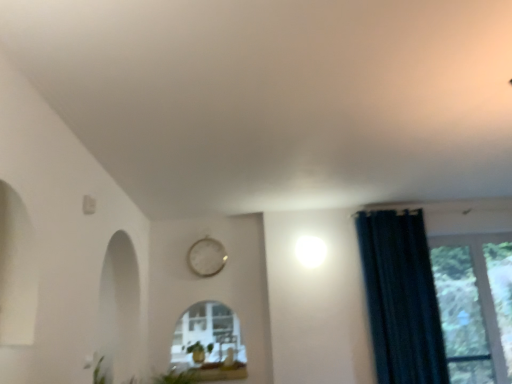
Question: From the image's perspective, relative to white glossy window sill at lower center, is transparent glass window at right above or below?

Choices:
 (A) above
 (B) below

Answer: (A)

Question: From a real-world perspective, relative to white glossy window sill at lower center, is transparent glass window at right vertically above or below?

Choices:
 (A) above
 (B) below

Answer: (A)

Question: Which is farther from the white glossy window sill at lower center?

Choices:
 (A) transparent glass window at right
 (B) green matte plant at lower center
 (C) dark blue fabric curtain at right
 (D) white metallic clock at upper center

Answer: (A)

Question: Which object is the farthest from the white glossy window sill at lower center?

Choices:
 (A) dark blue fabric curtain at right
 (B) green matte plant at lower center
 (C) white metallic clock at upper center
 (D) transparent glass window at right

Answer: (D)